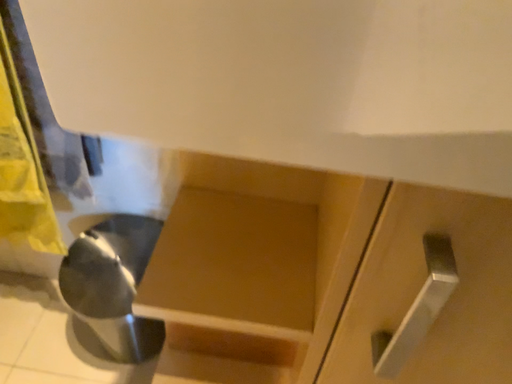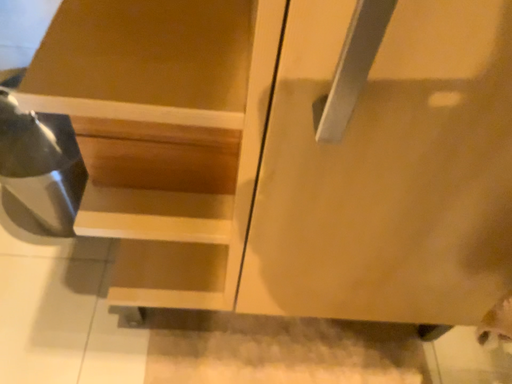
Question: Which way did the camera rotate in the video?

Choices:
 (A) rotated upward
 (B) rotated downward

Answer: (B)